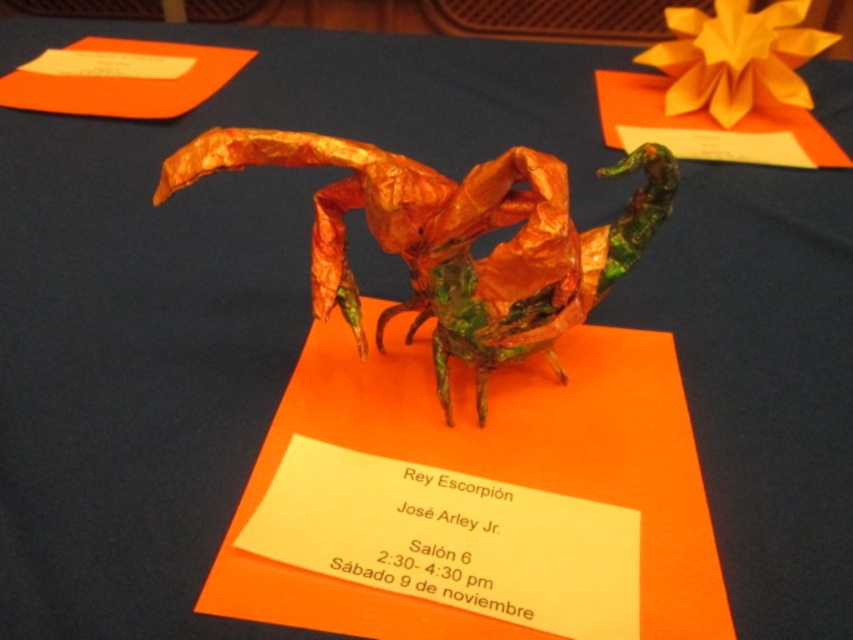
Question: Among these points, which one is farthest from the camera?

Choices:
 (A) (561, 216)
 (B) (767, 54)

Answer: (B)

Question: Which point is farther from the camera taking this photo?

Choices:
 (A) (508, 340)
 (B) (779, 29)

Answer: (B)

Question: Is metallic orange scorpion at center to the right of orange paper flower at upper center from the viewer's perspective?

Choices:
 (A) yes
 (B) no

Answer: (B)

Question: Can you confirm if metallic orange scorpion at center is bigger than orange paper flower at upper center?

Choices:
 (A) yes
 (B) no

Answer: (A)

Question: Can you confirm if metallic orange scorpion at center is smaller than orange paper flower at upper center?

Choices:
 (A) yes
 (B) no

Answer: (B)